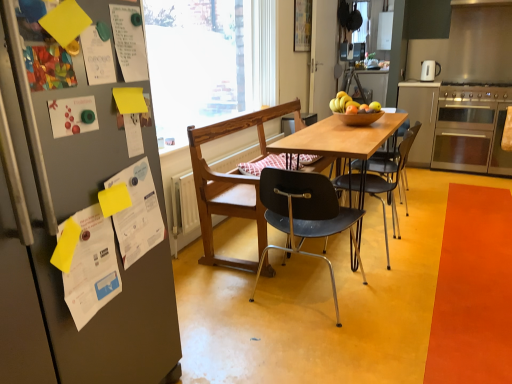
This screenshot has width=512, height=384. I want to click on vacant space that's between black plastic chair at center, positioned as the third chair in front-to-back order, and wooden table at center, so click(398, 232).